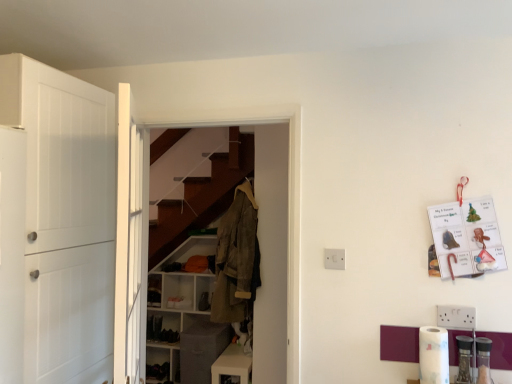
Measure the distance between point (237, 378) and camera.

A distance of 2.90 meters exists between point (237, 378) and camera.

This screenshot has height=384, width=512. What do you see at coordinates (66, 219) in the screenshot? I see `white matte door at left, which appears as the second door when viewed from the right` at bounding box center [66, 219].

Describe the element at coordinates (130, 243) in the screenshot. I see `white wooden door at center, arranged as the 2th door when viewed from the left` at that location.

The image size is (512, 384). What are the coordinates of `khaki cotton jacket at center` in the screenshot? It's located at (236, 258).

Locate an element on the screen. white glossy cabinet at lower center, which is the first cabinetry in right-to-left order is located at coordinates (232, 365).

Between white plastic electric outlet at center and white glossy cabinet at lower center, which is the first cabinetry in right-to-left order, which one is positioned behind?

white glossy cabinet at lower center, which is the first cabinetry in right-to-left order, is more distant.

Considering the positions of objects white plastic electric outlet at center and white glossy cabinet at lower center, marked as the first cabinetry in a front-to-back arrangement, in the image provided, who is more to the left, white plastic electric outlet at center or white glossy cabinet at lower center, marked as the first cabinetry in a front-to-back arrangement,?

From the viewer's perspective, white glossy cabinet at lower center, marked as the first cabinetry in a front-to-back arrangement, appears more on the left side.

Can you confirm if white plastic electric outlet at center is wider than white glossy cabinet at lower center, which is the first cabinetry in right-to-left order?

A: In fact, white plastic electric outlet at center might be narrower than white glossy cabinet at lower center, which is the first cabinetry in right-to-left order.

From a real-world perspective, is khaki cotton jacket at center physically located above or below white matte cabinet at center, the first cabinetry from the left?

Clearly, from a real-world perspective, khaki cotton jacket at center is above white matte cabinet at center, the first cabinetry from the left.

Considering the sizes of objects khaki cotton jacket at center and white matte cabinet at center, the first cabinetry from the left, in the image provided, who is wider, khaki cotton jacket at center or white matte cabinet at center, the first cabinetry from the left,?

Wider between the two is white matte cabinet at center, the first cabinetry from the left.

The width and height of the screenshot is (512, 384). Identify the location of clothing lying in front of the white matte cabinet at center, the second cabinetry viewed from the right. (236, 258).

Can you see khaki cotton jacket at center touching white matte cabinet at center, the first cabinetry from the left?

khaki cotton jacket at center is not next to white matte cabinet at center, the first cabinetry from the left, and they're not touching.

Can you confirm if white glossy cabinet at lower center, which is the first cabinetry in right-to-left order, is bigger than white matte cabinet at center, which is the 2th cabinetry from front to back?

No, white glossy cabinet at lower center, which is the first cabinetry in right-to-left order, is not bigger than white matte cabinet at center, which is the 2th cabinetry from front to back.

Could you tell me if white glossy cabinet at lower center, marked as the first cabinetry in a front-to-back arrangement, is facing white matte cabinet at center, the second cabinetry viewed from the right?

No, white glossy cabinet at lower center, marked as the first cabinetry in a front-to-back arrangement, is not oriented towards white matte cabinet at center, the second cabinetry viewed from the right.

How different are the orientations of white glossy cabinet at lower center, marked as the first cabinetry in a front-to-back arrangement, and white matte cabinet at center, the first cabinetry from the left, in degrees?

The angle between the facing direction of white glossy cabinet at lower center, marked as the first cabinetry in a front-to-back arrangement, and the facing direction of white matte cabinet at center, the first cabinetry from the left, is 90 degrees.

Do you think white wooden door at center, the 1th door positioned from the right, is within white matte cabinet at center, the 1th cabinetry positioned from the back, or outside of it?

white wooden door at center, the 1th door positioned from the right, is spatially situated outside white matte cabinet at center, the 1th cabinetry positioned from the back.

Measure the distance between white wooden door at center, the 1th door positioned from the right, and white matte cabinet at center, the second cabinetry viewed from the right.

white wooden door at center, the 1th door positioned from the right, is 1.69 meters away from white matte cabinet at center, the second cabinetry viewed from the right.

Considering the relative positions of white wooden door at center, arranged as the 2th door when viewed from the left, and white matte cabinet at center, the second cabinetry viewed from the right, in the image provided, is white wooden door at center, arranged as the 2th door when viewed from the left, to the right of white matte cabinet at center, the second cabinetry viewed from the right, from the viewer's perspective?

Yes, white wooden door at center, arranged as the 2th door when viewed from the left, is to the right of white matte cabinet at center, the second cabinetry viewed from the right.

Is white wooden door at center, the 1th door positioned from the right, next to white matte cabinet at center, which is the 2th cabinetry from front to back?

No, white wooden door at center, the 1th door positioned from the right, is not making contact with white matte cabinet at center, which is the 2th cabinetry from front to back.

Does brown suede coat at center have a larger size compared to white glossy cabinet at lower center, the 2th cabinetry from the left?

Yes.

Is white glossy cabinet at lower center, the 2th cabinetry from the left, a part of brown suede coat at center?

No, brown suede coat at center does not contain white glossy cabinet at lower center, the 2th cabinetry from the left.

Is brown suede coat at center touching white glossy cabinet at lower center, marked as the first cabinetry in a front-to-back arrangement?

They are not placed beside each other.

Is point (284, 303) in front of point (242, 383)?

Yes, it is in front of point (242, 383).

Is white matte door at left, placed as the 1th door when sorted from left to right, completely or partially outside of white matte cabinet at center, the second cabinetry viewed from the right?

Absolutely, white matte door at left, placed as the 1th door when sorted from left to right, is external to white matte cabinet at center, the second cabinetry viewed from the right.

This screenshot has height=384, width=512. I want to click on the 2nd door above the white matte cabinet at center, which is the 2th cabinetry from front to back (from the image's perspective), so click(66, 219).

From the image's perspective, which object appears higher, white matte door at left, which appears as the second door when viewed from the right, or white matte cabinet at center, the second cabinetry viewed from the right?

white matte door at left, which appears as the second door when viewed from the right.

Is white matte door at left, placed as the 1th door when sorted from left to right, positioned behind white matte cabinet at center, which is the 2th cabinetry from front to back?

That is False.

Looking at this image, is white matte door at left, which appears as the second door when viewed from the right, positioned in front of brown suede coat at center?

Yes, the depth of white matte door at left, which appears as the second door when viewed from the right, is less than that of brown suede coat at center.

Considering the sizes of white matte door at left, placed as the 1th door when sorted from left to right, and brown suede coat at center in the image, is white matte door at left, placed as the 1th door when sorted from left to right, wider or thinner than brown suede coat at center?

In the image, white matte door at left, placed as the 1th door when sorted from left to right, appears to be wider than brown suede coat at center.

Considering the positions of point (65, 301) and point (255, 360), is point (65, 301) closer or farther from the camera than point (255, 360)?

Clearly, point (65, 301) is closer to the camera than point (255, 360).

Does white matte door at left, which appears as the second door when viewed from the right, appear on the right side of brown suede coat at center?

In fact, white matte door at left, which appears as the second door when viewed from the right, is to the left of brown suede coat at center.

From the white plastic electric outlet at center, count 1st cabinetrys backward and point to it. Please provide its 2D coordinates.

[(232, 365)]

What are the coordinates of `clothing above the white matte cabinet at center, the first cabinetry from the left (from the image's perspective)` in the screenshot? It's located at (236, 258).

Based on the photo, looking at the image, which one is located closer to white plastic electric outlet at center, white matte door at left, placed as the 1th door when sorted from left to right, or white matte cabinet at center, the first cabinetry from the left?

white matte door at left, placed as the 1th door when sorted from left to right.

Which object lies further to the anchor point white plastic electric outlet at center, brown suede coat at center or white matte cabinet at center, which is the 2th cabinetry from front to back?

→ white matte cabinet at center, which is the 2th cabinetry from front to back, is further to white plastic electric outlet at center.

Which object lies further to the anchor point white plastic electric outlet at center, white matte door at left, which appears as the second door when viewed from the right, or khaki cotton jacket at center?

Based on the image, khaki cotton jacket at center appears to be further to white plastic electric outlet at center.

Which object lies further to the anchor point white matte door at left, placed as the 1th door when sorted from left to right, khaki cotton jacket at center or white glossy cabinet at lower center, positioned as the second cabinetry in back-to-front order?

white glossy cabinet at lower center, positioned as the second cabinetry in back-to-front order.

From the image, which object appears to be farther from brown suede coat at center, white wooden door at center, the 1th door positioned from the right, or white matte cabinet at center, the 1th cabinetry positioned from the back?

Among the two, white wooden door at center, the 1th door positioned from the right, is located further to brown suede coat at center.

When comparing their distances from white matte cabinet at center, the 1th cabinetry positioned from the back, does white plastic electric outlet at center or khaki cotton jacket at center seem further?

white plastic electric outlet at center.

From the image, which object appears to be farther from white glossy cabinet at lower center, positioned as the second cabinetry in back-to-front order, brown suede coat at center or white wooden door at center, the 1th door positioned from the right?

white wooden door at center, the 1th door positioned from the right.

Based on their spatial positions, is white plastic electric outlet at center or white matte cabinet at center, the 1th cabinetry positioned from the back, further from white matte door at left, which appears as the second door when viewed from the right?

The object further to white matte door at left, which appears as the second door when viewed from the right, is white matte cabinet at center, the 1th cabinetry positioned from the back.

Where is `cabinetry positioned between white wooden door at center, the 1th door positioned from the right, and white matte cabinet at center, the 1th cabinetry positioned from the back, from near to far`? This screenshot has width=512, height=384. cabinetry positioned between white wooden door at center, the 1th door positioned from the right, and white matte cabinet at center, the 1th cabinetry positioned from the back, from near to far is located at coordinates (232, 365).

At what (x,y) coordinates should I click in order to perform the action: click on clothing located between brown suede coat at center and white matte cabinet at center, the second cabinetry viewed from the right, in the depth direction. Please return your answer as a coordinate pair (x, y). The image size is (512, 384). Looking at the image, I should click on (236, 258).

Locate an element on the screen. electric outlet positioned between white wooden door at center, the 1th door positioned from the right, and white glossy cabinet at lower center, marked as the first cabinetry in a front-to-back arrangement, from near to far is located at coordinates (334, 259).

Locate an element on the screen. The height and width of the screenshot is (384, 512). electric outlet positioned between white wooden door at center, arranged as the 2th door when viewed from the left, and khaki cotton jacket at center from near to far is located at coordinates (334, 259).